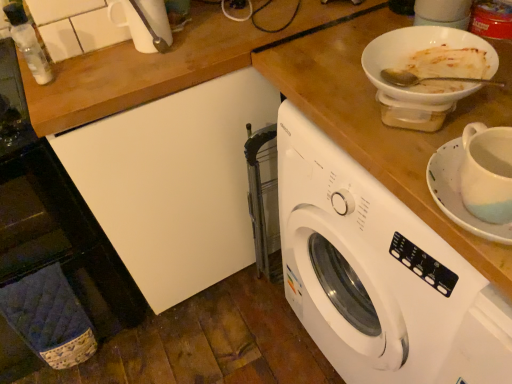
The height and width of the screenshot is (384, 512). Describe the element at coordinates (28, 43) in the screenshot. I see `transparent plastic bottle at upper left` at that location.

The height and width of the screenshot is (384, 512). What do you see at coordinates (379, 274) in the screenshot?
I see `white plastic washing machine at center` at bounding box center [379, 274].

The width and height of the screenshot is (512, 384). Describe the element at coordinates (459, 193) in the screenshot. I see `white ceramic saucer at right` at that location.

What do you see at coordinates (421, 50) in the screenshot? The width and height of the screenshot is (512, 384). I see `white glossy bowl at upper right` at bounding box center [421, 50].

Where is `transparent plastic bottle at upper left`? The height and width of the screenshot is (384, 512). transparent plastic bottle at upper left is located at coordinates point(28,43).

Measure the distance from transparent plastic bottle at upper left to white plastic washing machine at center.

33.36 inches.

Which is further, (18,8) or (294,205)?

Point (18,8)

Is the surface of transparent plastic bottle at upper left in direct contact with white plastic washing machine at center?

No, transparent plastic bottle at upper left is not with white plastic washing machine at center.

From a real-world perspective, between transparent plastic bottle at upper left and white plastic washing machine at center, who is vertically higher?

transparent plastic bottle at upper left, from a real-world perspective.

From their relative heights in the image, would you say transparent plastic bottle at upper left is taller or shorter than white ceramic saucer at right?

In the image, transparent plastic bottle at upper left appears to be taller than white ceramic saucer at right.

Is transparent plastic bottle at upper left to the right of white ceramic saucer at right from the viewer's perspective?

No.

Considering the sizes of objects transparent plastic bottle at upper left and white ceramic saucer at right in the image provided, who is smaller, transparent plastic bottle at upper left or white ceramic saucer at right?

Smaller between the two is transparent plastic bottle at upper left.

Looking at their sizes, would you say transparent plastic bottle at upper left is wider or thinner than white ceramic saucer at right?

transparent plastic bottle at upper left is thinner than white ceramic saucer at right.

Consider the image. From the image's perspective, which one is positioned higher, white glossy bowl at upper right or transparent plastic bottle at upper left?

From the image's view, transparent plastic bottle at upper left is above.

Consider the image. Does white glossy bowl at upper right have a greater width compared to transparent plastic bottle at upper left?

Yes, white glossy bowl at upper right is wider than transparent plastic bottle at upper left.

Can you see white glossy bowl at upper right touching white ceramic saucer at right?

No, white glossy bowl at upper right is not making contact with white ceramic saucer at right.

How different are the orientations of white glossy bowl at upper right and white ceramic saucer at right in degrees?

white glossy bowl at upper right and white ceramic saucer at right are facing 3.24 degrees away from each other.

How far apart are white glossy bowl at upper right and white ceramic saucer at right?

A distance of 7.16 inches exists between white glossy bowl at upper right and white ceramic saucer at right.

Can you confirm if white glossy bowl at upper right is bigger than white ceramic saucer at right?

Answer: Actually, white glossy bowl at upper right might be smaller than white ceramic saucer at right.

Does white ceramic saucer at right have a smaller size compared to white plastic washing machine at center?

Yes.

Measure the distance between white ceramic saucer at right and white plastic washing machine at center.

white ceramic saucer at right is 12.82 inches from white plastic washing machine at center.

Image resolution: width=512 pixels, height=384 pixels. Find the location of `washing machine located underneath the white ceramic saucer at right (from a real-world perspective)`. washing machine located underneath the white ceramic saucer at right (from a real-world perspective) is located at coordinates (379, 274).

Is white ceramic saucer at right further to camera compared to transparent plastic bottle at upper left?

No, white ceramic saucer at right is closer to the viewer.

Considering the relative sizes of white ceramic saucer at right and transparent plastic bottle at upper left in the image provided, is white ceramic saucer at right bigger than transparent plastic bottle at upper left?

Yes, white ceramic saucer at right is bigger than transparent plastic bottle at upper left.

Is white ceramic saucer at right positioned far away from transparent plastic bottle at upper left?

No, white ceramic saucer at right is in close proximity to transparent plastic bottle at upper left.

Does white ceramic saucer at right turn towards transparent plastic bottle at upper left?

No.

Does white plastic washing machine at center turn towards white glossy bowl at upper right?

No, white plastic washing machine at center is not turned towards white glossy bowl at upper right.

Is white plastic washing machine at center situated inside white glossy bowl at upper right or outside?

white plastic washing machine at center cannot be found inside white glossy bowl at upper right.

Which is behind, white plastic washing machine at center or white glossy bowl at upper right?

Positioned behind is white glossy bowl at upper right.

How different are the orientations of white plastic washing machine at center and white glossy bowl at upper right in degrees?

They differ by 10.5 degrees in their facing directions.

At what (x,y) coordinates should I click in order to perform the action: click on bottle that appears behind the white plastic washing machine at center. Please return your answer as a coordinate pair (x, y). Looking at the image, I should click on (28, 43).

Image resolution: width=512 pixels, height=384 pixels. In order to click on bottle above the white ceramic saucer at right (from a real-world perspective) in this screenshot , I will do `click(28, 43)`.

Considering their positions, is white ceramic saucer at right positioned closer to transparent plastic bottle at upper left than white glossy bowl at upper right?

white glossy bowl at upper right lies closer to transparent plastic bottle at upper left than the other object.

Looking at the image, which one is located closer to white ceramic saucer at right, white plastic washing machine at center or white glossy bowl at upper right?

white glossy bowl at upper right.

When comparing their distances from white glossy bowl at upper right, does transparent plastic bottle at upper left or white ceramic saucer at right seem closer?

white ceramic saucer at right is positioned closer to the anchor white glossy bowl at upper right.

Looking at this image, looking at the image, which one is located further to white ceramic saucer at right, white glossy bowl at upper right or transparent plastic bottle at upper left?

The object further to white ceramic saucer at right is transparent plastic bottle at upper left.

Which object lies nearer to the anchor point transparent plastic bottle at upper left, white glossy bowl at upper right or white plastic washing machine at center?

The object closer to transparent plastic bottle at upper left is white glossy bowl at upper right.

Considering their positions, is white plastic washing machine at center positioned further to transparent plastic bottle at upper left than white ceramic saucer at right?

Among the two, white ceramic saucer at right is located further to transparent plastic bottle at upper left.

Based on their spatial positions, is white plastic washing machine at center or transparent plastic bottle at upper left further from white ceramic saucer at right?

transparent plastic bottle at upper left.

Which object lies further to the anchor point transparent plastic bottle at upper left, white glossy bowl at upper right or white ceramic saucer at right?

white ceramic saucer at right is positioned further to the anchor transparent plastic bottle at upper left.

Find the location of a particular element. This screenshot has height=384, width=512. saucer between white glossy bowl at upper right and white plastic washing machine at center in the vertical direction is located at coordinates (459, 193).

The width and height of the screenshot is (512, 384). In order to click on tableware between transparent plastic bottle at upper left and white plastic washing machine at center from left to right in this screenshot , I will do `click(421, 50)`.

Locate an element on the screen. The image size is (512, 384). tableware between transparent plastic bottle at upper left and white ceramic saucer at right from left to right is located at coordinates (421, 50).

Identify the location of saucer located between transparent plastic bottle at upper left and white plastic washing machine at center in the left-right direction. The height and width of the screenshot is (384, 512). (459, 193).